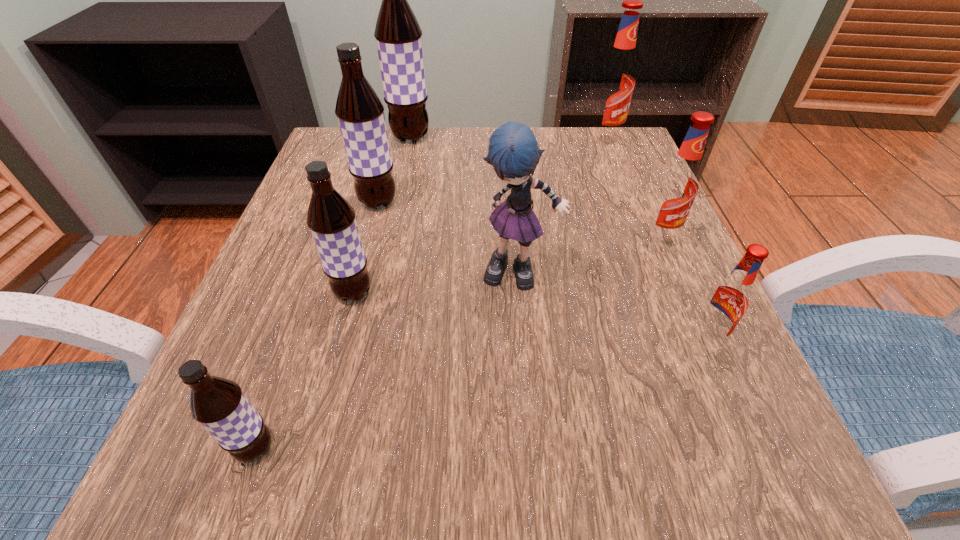
Locate an element on the screen. Image resolution: width=960 pixels, height=540 pixels. free space at the right edge of the desktop is located at coordinates (681, 392).

The image size is (960, 540). Find the location of `vacant space at the far left corner of the desktop`. vacant space at the far left corner of the desktop is located at coordinates (340, 164).

Image resolution: width=960 pixels, height=540 pixels. I want to click on vacant region at the far right corner of the desktop, so click(x=631, y=170).

This screenshot has height=540, width=960. In order to click on vacant area that lies between the fifth object from left to right and the second nearest red root beer in this screenshot , I will do `click(589, 256)`.

In order to click on empty space between the tallest object and the second nearest brown root beer in this screenshot , I will do coord(382,215).

Locate an element on the screen. This screenshot has height=540, width=960. empty location between the nearest root beer and the fourth object from right to left is located at coordinates (388, 361).

You are a GUI agent. You are given a task and a screenshot of the screen. Output one action in this format:
    pyautogui.click(x=<x>, y=<y>)
    Task: Click on the vacant area that lies between the tallest root beer and the seventh farthest object
    This screenshot has height=540, width=960.
    Given the screenshot: What is the action you would take?
    pyautogui.click(x=559, y=238)

Find the location of a particular element. empty location between the second smallest brown root beer and the leftmost brown root beer is located at coordinates (304, 371).

Locate an element on the screen. This screenshot has width=960, height=540. empty space that is in between the tallest root beer and the fifth farthest root beer is located at coordinates (382, 215).

Identify the location of free spot between the leftmost brown root beer and the fourth nearest root beer. (457, 343).